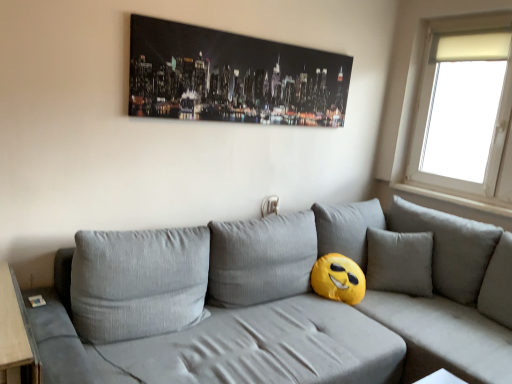
Locate an element on the screen. The image size is (512, 384). free spot below white frosted glass window at upper right (from a real-world perspective) is located at coordinates (449, 195).